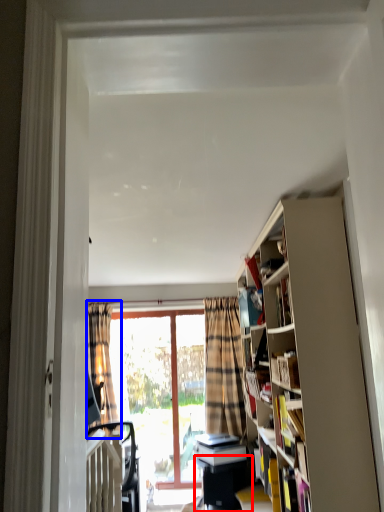
Question: Which object appears closest to the camera in this image, table (highlighted by a red box) or curtain (highlighted by a blue box)?

Choices:
 (A) table
 (B) curtain

Answer: (A)